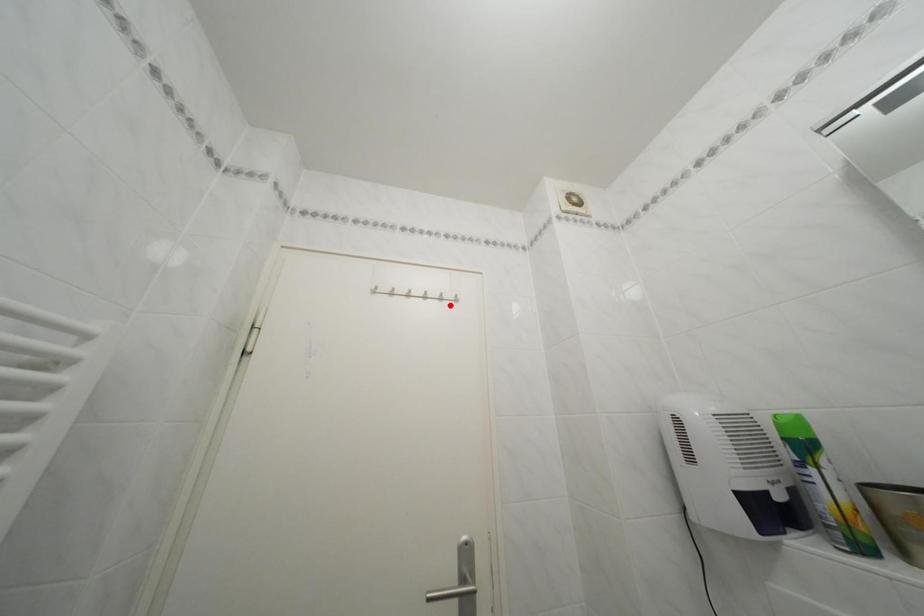
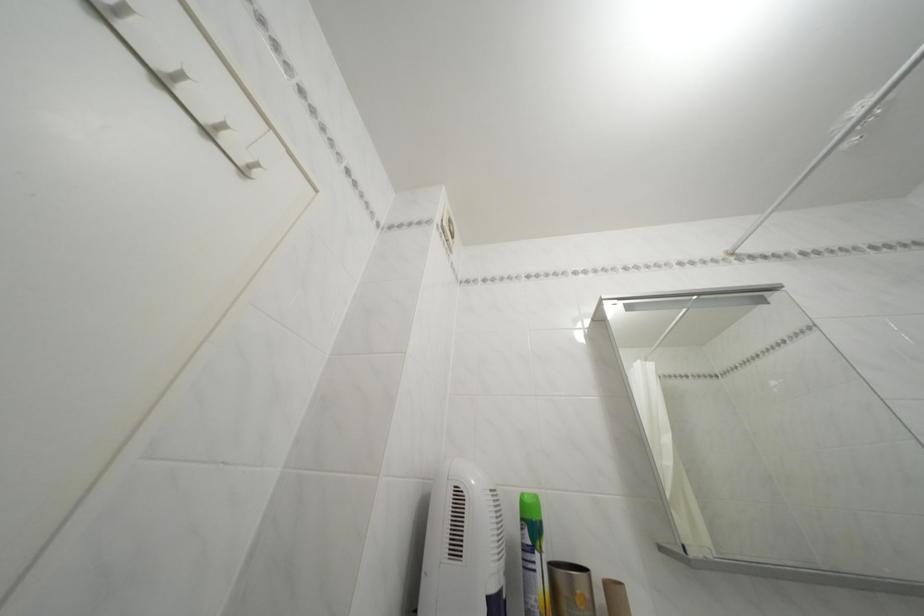
Where in the second image is the point corresponding to the highlighted location from the first image?

(216, 139)